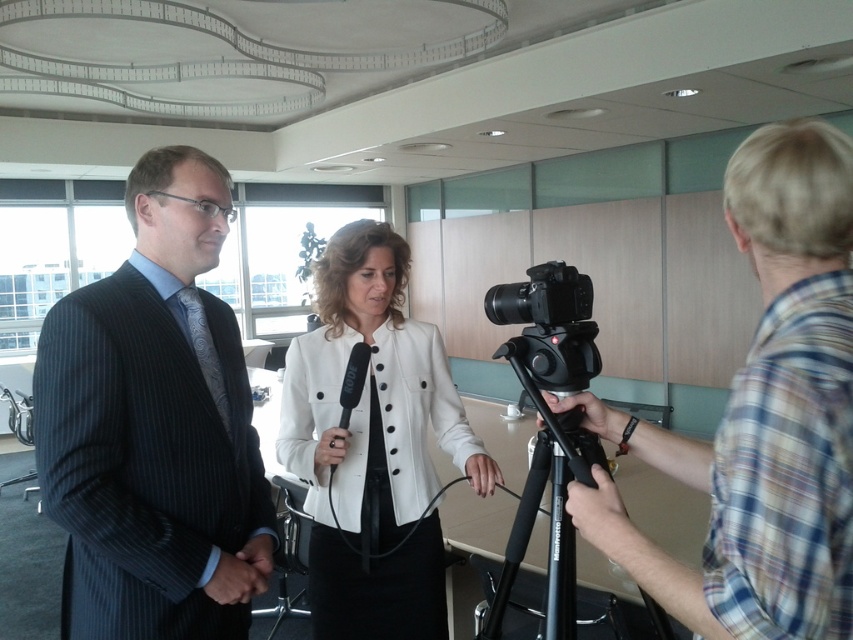
Question: Does black plastic camera at center appear on the left side of black rubber tripod at lower right?

Choices:
 (A) no
 (B) yes

Answer: (B)

Question: Does plaid shirt at right appear on the left side of white matte jacket at center?

Choices:
 (A) no
 (B) yes

Answer: (A)

Question: Is white matte jacket at center bigger than black rubber tripod at lower right?

Choices:
 (A) no
 (B) yes

Answer: (B)

Question: Which point is farther to the camera?

Choices:
 (A) (554, 433)
 (B) (494, 294)

Answer: (B)

Question: Which object is farther from the camera taking this photo?

Choices:
 (A) black rubber tripod at lower right
 (B) black plastic camera at center
 (C) dark pinstripe suit at left

Answer: (C)

Question: Considering the real-world distances, which object is closest to the black rubber tripod at lower right?

Choices:
 (A) plaid shirt at right
 (B) dark pinstripe suit at left
 (C) black plastic camera at center
 (D) white matte jacket at center

Answer: (C)